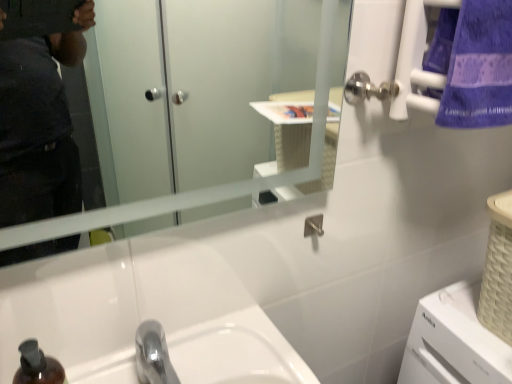
Question: Considering the relative sizes of clear glass mirror at upper center and chrome metallic sink at center in the image provided, is clear glass mirror at upper center wider than chrome metallic sink at center?

Choices:
 (A) no
 (B) yes

Answer: (A)

Question: Could you tell me if clear glass mirror at upper center is facing chrome metallic sink at center?

Choices:
 (A) no
 (B) yes

Answer: (A)

Question: Does clear glass mirror at upper center appear on the right side of chrome metallic sink at center?

Choices:
 (A) yes
 (B) no

Answer: (A)

Question: Does clear glass mirror at upper center have a lesser width compared to chrome metallic sink at center?

Choices:
 (A) no
 (B) yes

Answer: (B)

Question: Is clear glass mirror at upper center positioned behind chrome metallic sink at center?

Choices:
 (A) no
 (B) yes

Answer: (A)

Question: Can chrome metallic sink at center be found inside clear glass mirror at upper center?

Choices:
 (A) yes
 (B) no

Answer: (B)

Question: Is the position of purple cotton towel at upper right less distant than that of chrome metallic sink at center?

Choices:
 (A) no
 (B) yes

Answer: (A)

Question: Is purple cotton towel at upper right smaller than chrome metallic sink at center?

Choices:
 (A) yes
 (B) no

Answer: (A)

Question: Can you confirm if purple cotton towel at upper right is taller than chrome metallic sink at center?

Choices:
 (A) no
 (B) yes

Answer: (B)

Question: Is chrome metallic sink at center inside purple cotton towel at upper right?

Choices:
 (A) yes
 (B) no

Answer: (B)

Question: Is purple cotton towel at upper right to the right of chrome metallic sink at center from the viewer's perspective?

Choices:
 (A) no
 (B) yes

Answer: (B)

Question: From the image's perspective, is purple cotton towel at upper right on chrome metallic sink at center?

Choices:
 (A) yes
 (B) no

Answer: (A)

Question: Is chrome metallic sink at center to the right of clear glass mirror at upper center from the viewer's perspective?

Choices:
 (A) no
 (B) yes

Answer: (A)